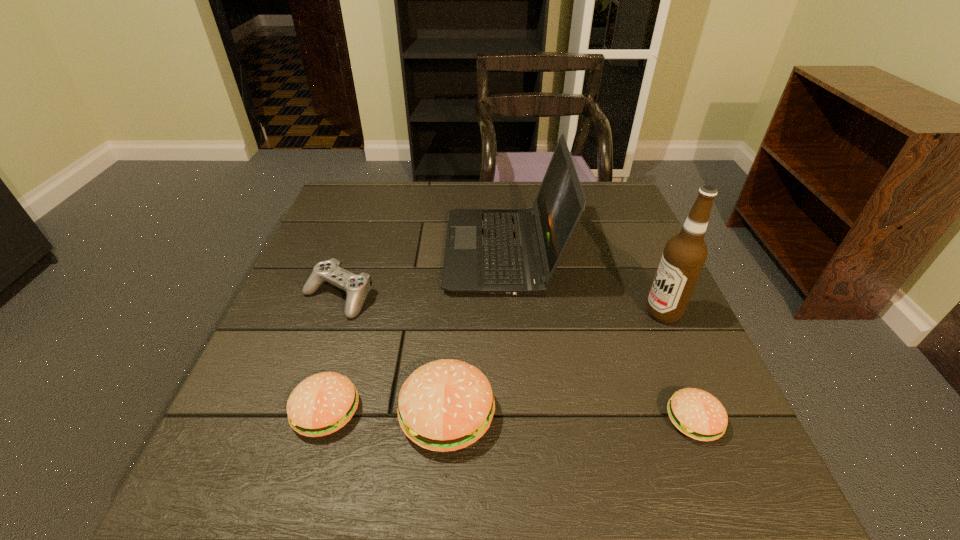
Where is `location for an additional patty_(food) to make spacing equal`? location for an additional patty_(food) to make spacing equal is located at coordinates (569, 417).